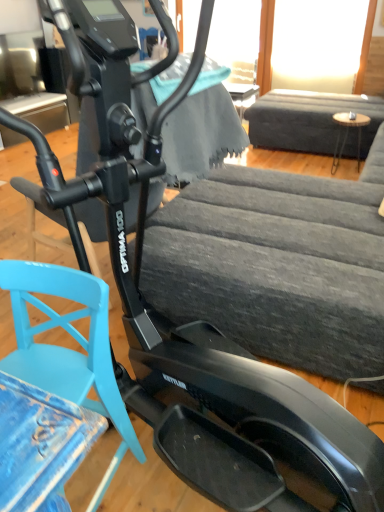
Question: Considering the relative sizes of light blue plastic swivel chair at lower left and dark gray fabric couch at upper right in the image provided, is light blue plastic swivel chair at lower left wider than dark gray fabric couch at upper right?

Choices:
 (A) yes
 (B) no

Answer: (B)

Question: From the image's perspective, would you say light blue plastic swivel chair at lower left is positioned over dark gray fabric couch at upper right?

Choices:
 (A) yes
 (B) no

Answer: (B)

Question: From a real-world perspective, is light blue plastic swivel chair at lower left physically below dark gray fabric couch at upper right?

Choices:
 (A) yes
 (B) no

Answer: (A)

Question: Can you confirm if light blue plastic swivel chair at lower left is positioned to the left of dark gray fabric couch at upper right?

Choices:
 (A) no
 (B) yes

Answer: (B)

Question: Is dark gray fabric couch at upper right at the back of light blue plastic swivel chair at lower left?

Choices:
 (A) yes
 (B) no

Answer: (A)

Question: Can you confirm if light blue plastic swivel chair at lower left is shorter than dark gray fabric couch at upper right?

Choices:
 (A) no
 (B) yes

Answer: (B)

Question: Is light blue plastic swivel chair at lower left surrounded by dark gray fabric couch at upper right?

Choices:
 (A) yes
 (B) no

Answer: (B)

Question: Does dark gray fabric couch at upper right appear on the left side of light blue plastic swivel chair at lower left?

Choices:
 (A) no
 (B) yes

Answer: (A)

Question: Is dark gray fabric couch at upper right further to camera compared to light blue plastic swivel chair at lower left?

Choices:
 (A) no
 (B) yes

Answer: (B)

Question: From a real-world perspective, does dark gray fabric couch at upper right sit lower than light blue plastic swivel chair at lower left?

Choices:
 (A) yes
 (B) no

Answer: (B)

Question: From the image's perspective, is dark gray fabric couch at upper right beneath light blue plastic swivel chair at lower left?

Choices:
 (A) yes
 (B) no

Answer: (B)

Question: Can you confirm if dark gray fabric couch at upper right is smaller than light blue plastic swivel chair at lower left?

Choices:
 (A) no
 (B) yes

Answer: (A)

Question: Considering the relative sizes of light blue plastic swivel chair at lower left and wooden round table at right in the image provided, is light blue plastic swivel chair at lower left smaller than wooden round table at right?

Choices:
 (A) no
 (B) yes

Answer: (A)